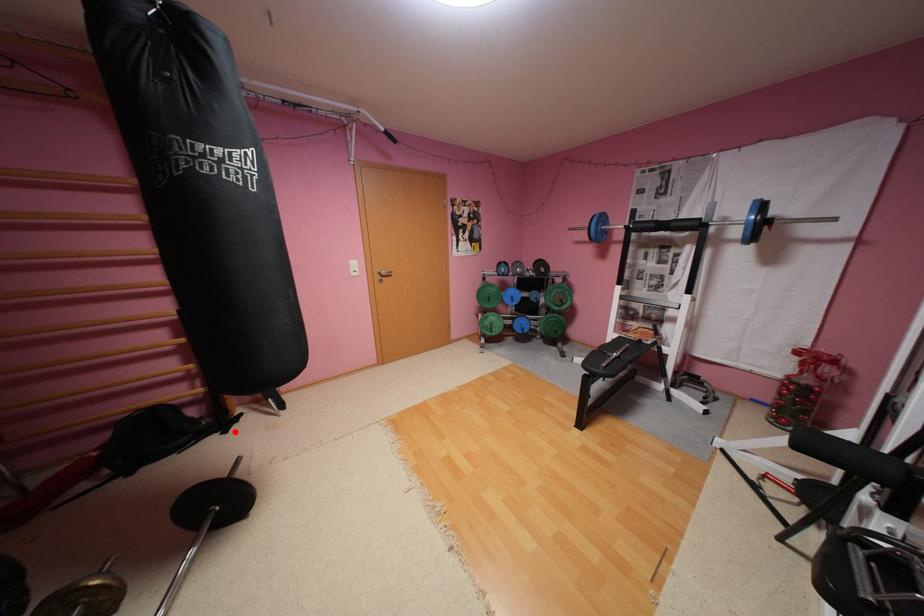
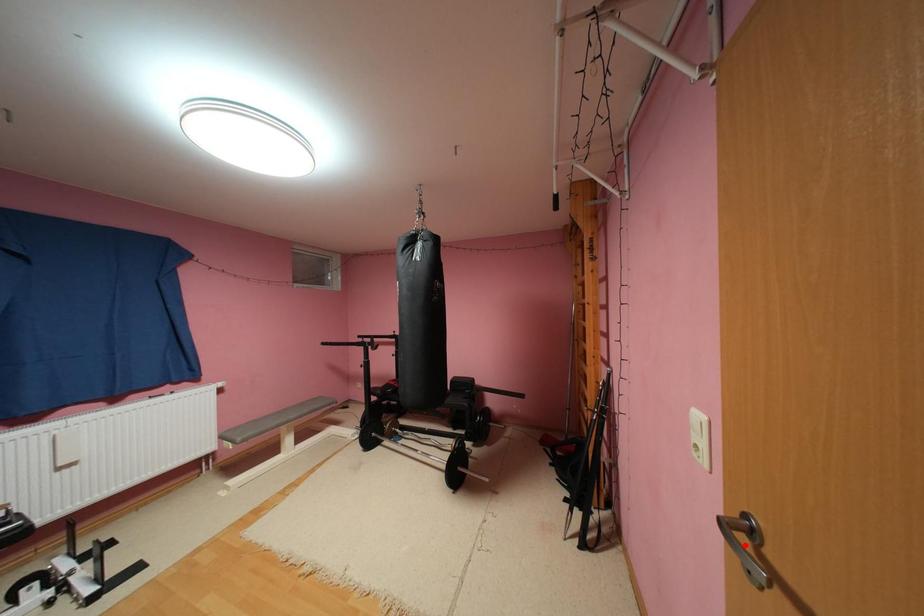
I am providing you with two images of the same scene from different viewpoints. A red point is marked on the first image and another point is marked on the second image. Is the marked point in image1 the same physical position as the marked point in image2?

No